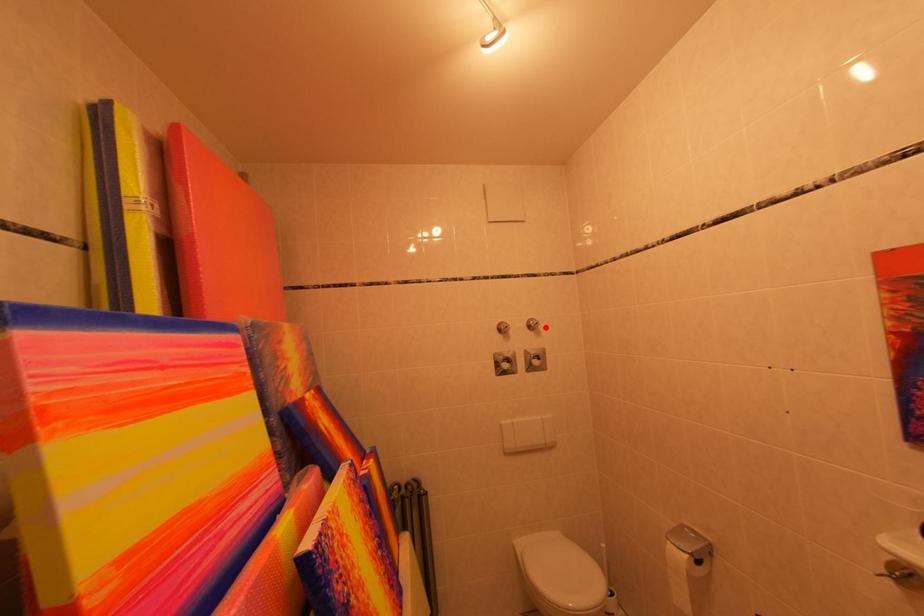
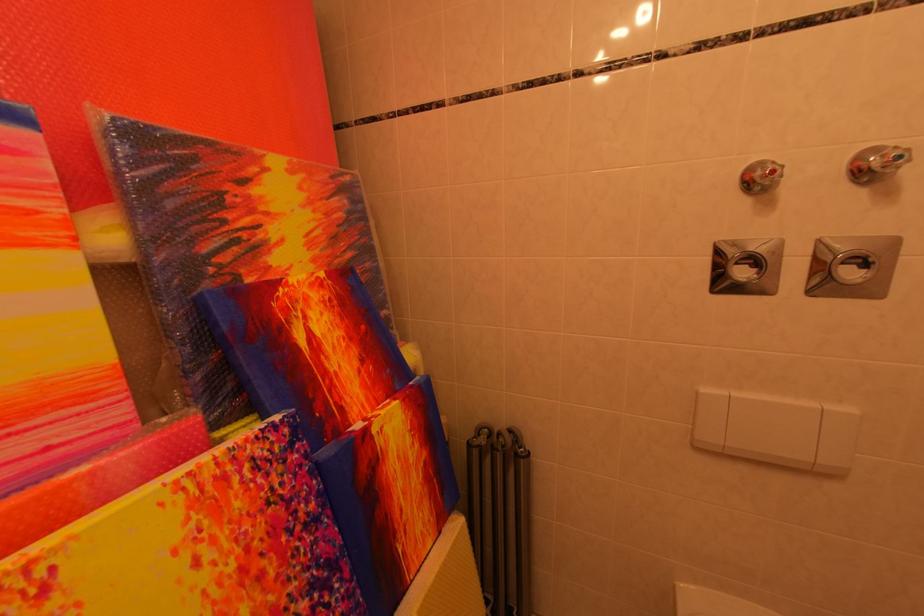
Question: I am providing you with two images of the same scene from different viewpoints. A red point is shown in image1. For the corresponding object point in image2, is it positioned nearer or farther from the camera?

Choices:
 (A) Nearer
 (B) Farther

Answer: (B)